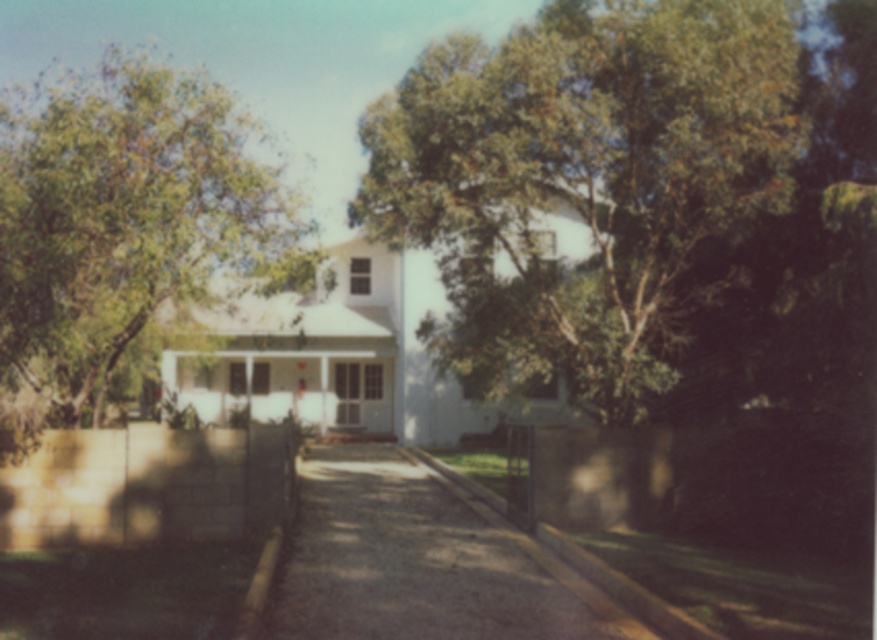
You are a delivery person with a 3.5 meter long truck that needs to back up into the gravelly asphalt driveway at center. The green leafy tree at upper center is in your way. Can you safely back your truck without hitting the tree?

The distance between the green leafy tree at upper center and the gravelly asphalt driveway at center is 4.29 meters. Since the truck is 3.5 meters long, there is enough space to safely back up without hitting the tree.

You are a landscape architect designing a new pathway for the suburban house. The pathway must be wide enough to accommodate a 4ft wide garden cart. Given the green leafy tree at upper center and the gravelly asphalt driveway at center, which object can you use as a reference to ensure the pathway meets the required width?

The green leafy tree at upper center has a larger width than the gravelly asphalt driveway at center. Since the driveway is narrower than the tree, the driveway can be used as a reference to ensure the pathway meets the required width of 4ft, as the tree is wider and may not be necessary for the cart pathway.